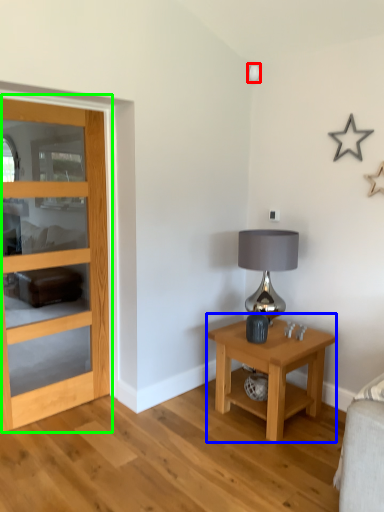
Question: Which object is positioned farthest from lamp (highlighted by a red box)? Select from nightstand (highlighted by a blue box) and door (highlighted by a green box).

Choices:
 (A) nightstand
 (B) door

Answer: (A)